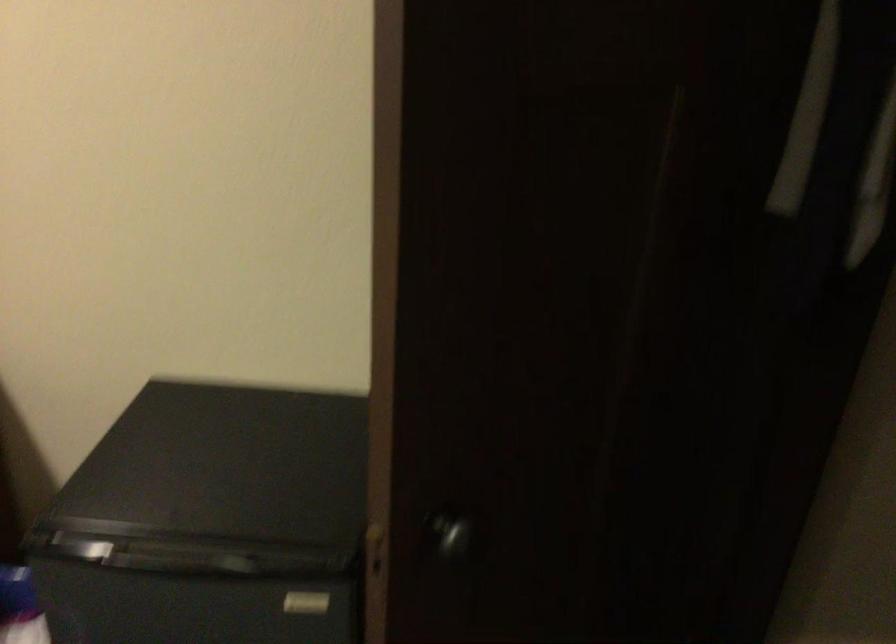
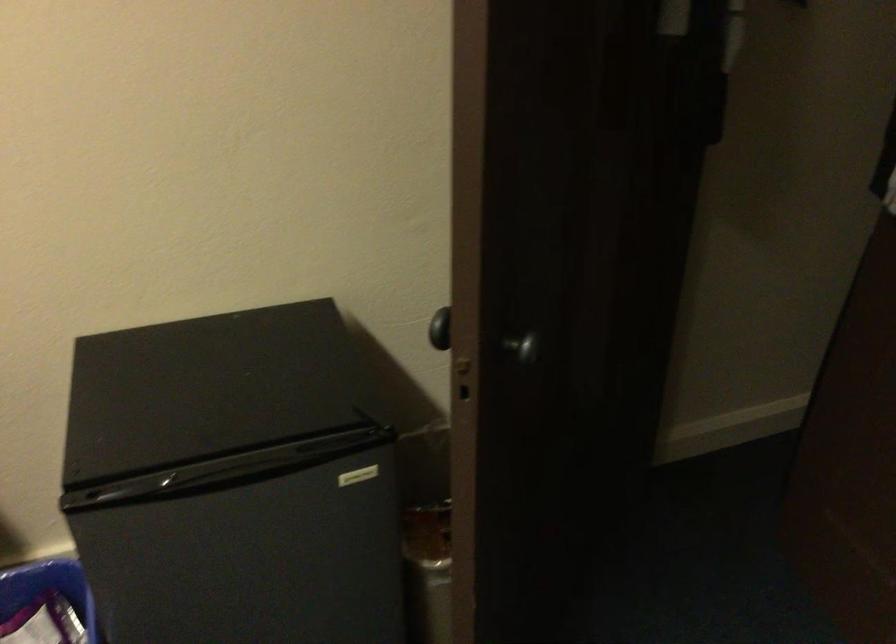
Question: The camera is either moving clockwise (left) or counter-clockwise (right) around the object. The first image is from the beginning of the video and the second image is from the end. Is the camera moving left or right when shooting the video?

Choices:
 (A) Left
 (B) Right

Answer: (A)